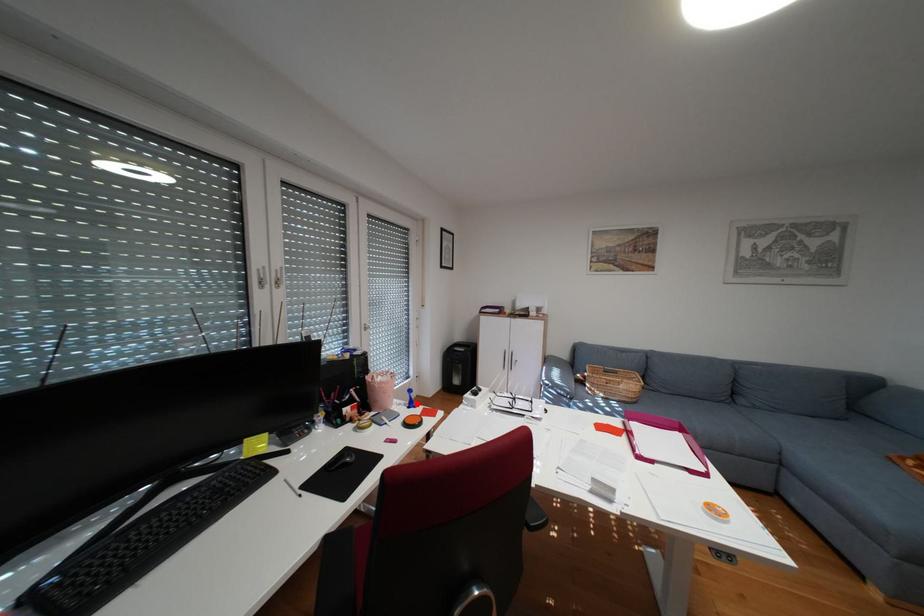
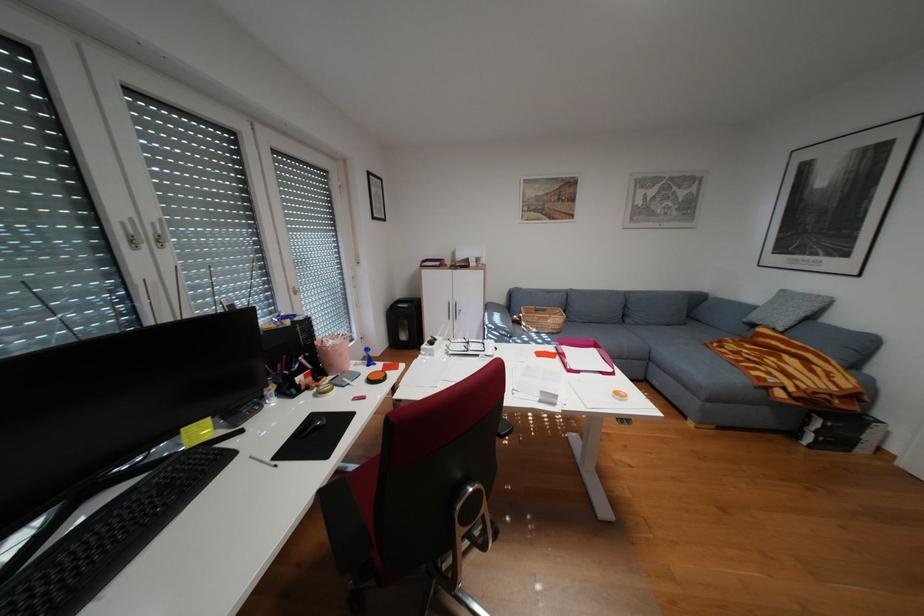
Locate, in the second image, the point that corresponds to the highlighted location in the first image.

(375, 363)